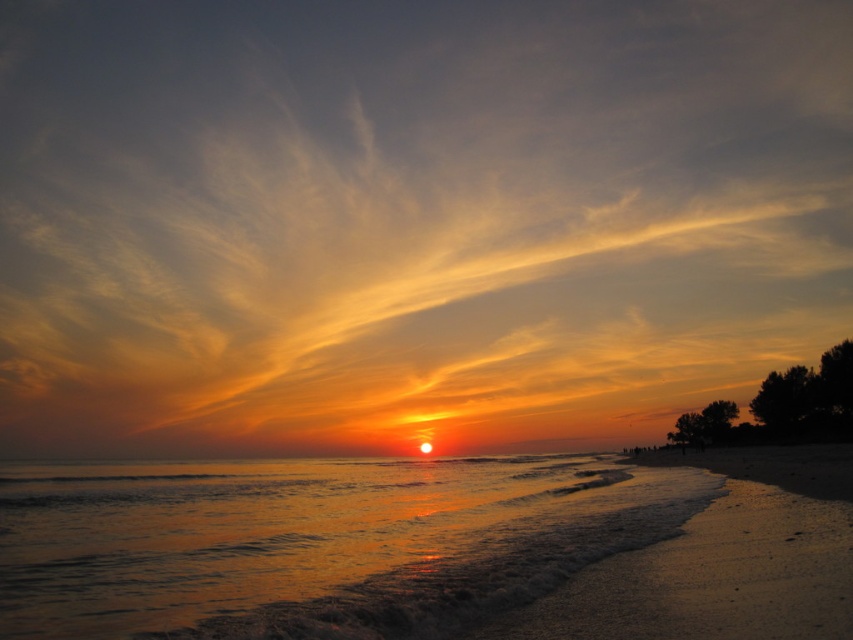
Question: Is orange/yellow cloud at center bigger than glistening golden water at center?

Choices:
 (A) yes
 (B) no

Answer: (A)

Question: Which object is positioned farthest from the glistening golden water at center?

Choices:
 (A) sandy beach at lower right
 (B) orange/yellow cloud at center

Answer: (B)

Question: Can you confirm if orange/yellow cloud at center is positioned below sandy beach at lower right?

Choices:
 (A) yes
 (B) no

Answer: (B)

Question: Can you confirm if glistening golden water at center is positioned to the right of sandy beach at lower right?

Choices:
 (A) no
 (B) yes

Answer: (A)

Question: Which object appears farthest from the camera in this image?

Choices:
 (A) glistening golden water at center
 (B) sandy beach at lower right

Answer: (A)

Question: Among these objects, which one is farthest from the camera?

Choices:
 (A) orange/yellow cloud at center
 (B) glistening golden water at center
 (C) sandy beach at lower right

Answer: (A)